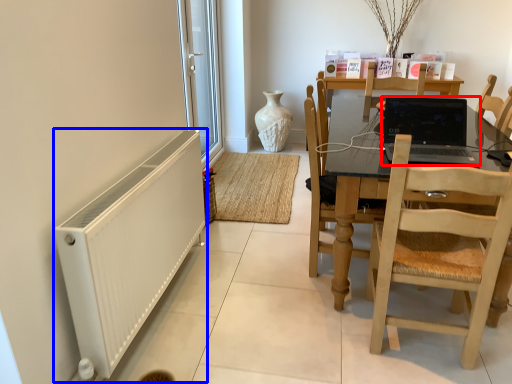
Question: Which object appears closest to the camera in this image, laptop (highlighted by a red box) or radiator (highlighted by a blue box)?

Choices:
 (A) laptop
 (B) radiator

Answer: (B)